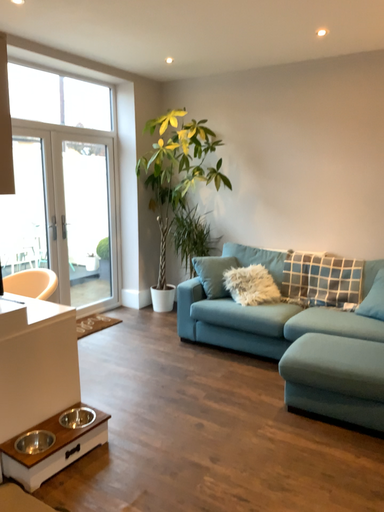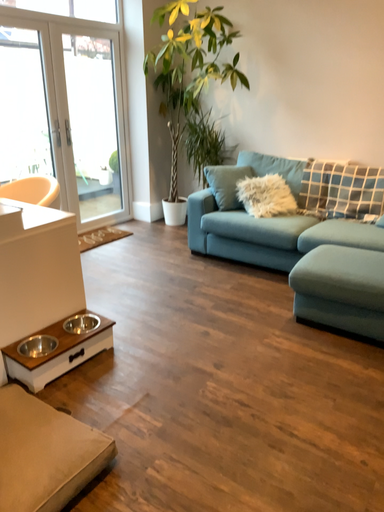
Question: Which way did the camera rotate in the video?

Choices:
 (A) rotated upward
 (B) rotated downward

Answer: (B)